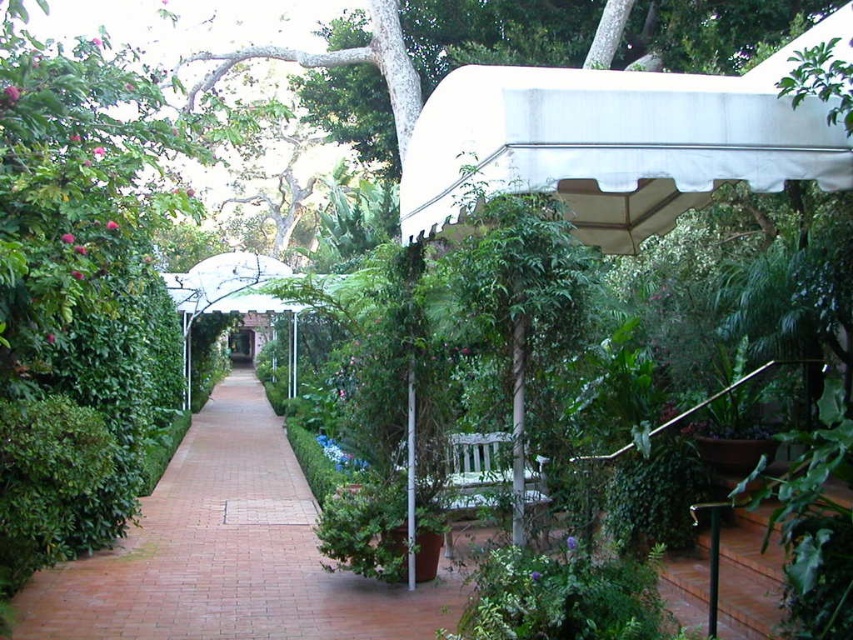
You are a gardener who needs to install a new light fixture. You have a 1.2 meter tall pole. The white fabric canopy at upper right and the brick at center are in your way. Which object will the pole hit first if you place it directly in the center of the pathway?

The white fabric canopy at upper right is taller than the brick at center, so the pole will hit the white fabric canopy at upper right first.

You are a maintenance worker needing to reach the white fabric canopy at upper right from the bench. The distance between them is 3.59 meters. If your ladder is 3 meters long, will it be sufficient to reach the canopy from the bench?

The distance between the white fabric canopy at upper right and the bench is 3.59 meters, which is longer than the ladder length of 3 meters. Therefore, the ladder will not be sufficient to reach the canopy from the bench.

You are a gardener planning to install a new light fixture. You need to decide whether to place it under the white fabric canopy at upper right or on the brick at center. Based on their positions, which location would allow the light to be visible from the main pathway without obstruction?

The white fabric canopy at upper right is in front of the brick at center, so placing the light on the brick at center would make it visible from the main pathway without obstruction.